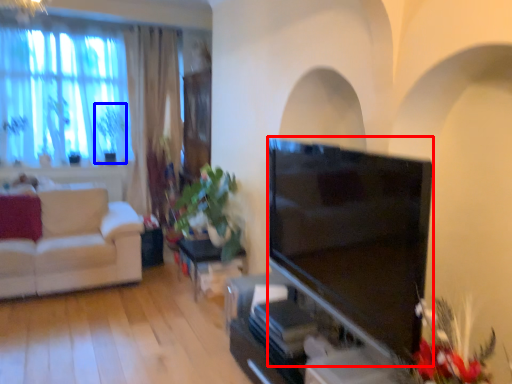
Question: Which object is closer to the camera taking this photo, television (highlighted by a red box) or plant (highlighted by a blue box)?

Choices:
 (A) television
 (B) plant

Answer: (A)